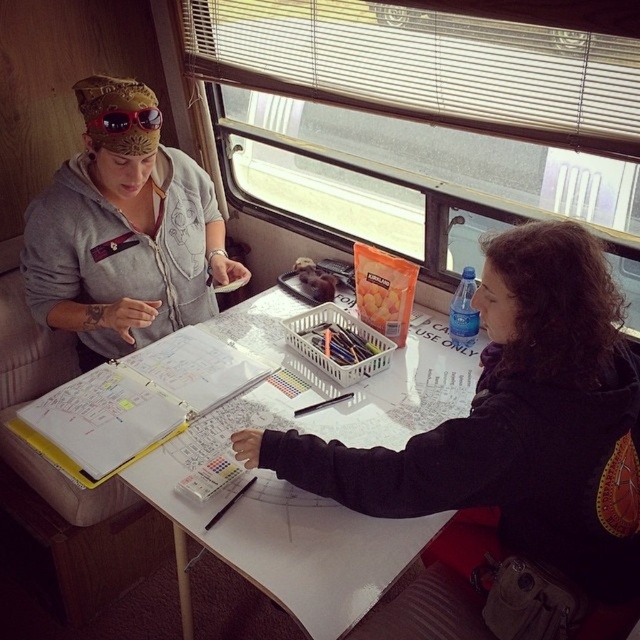
Question: Which point is closer to the camera?

Choices:
 (A) matte gray hoodie at upper left
 (B) matte plastic ruler at center
 (C) white paper at center

Answer: (C)

Question: Which of the following is the closest to the observer?

Choices:
 (A) (596, 589)
 (B) (243, 492)
 (C) (317, 406)
 (D) (352, 573)

Answer: (D)

Question: Can you confirm if black matte hoodie at center is positioned above red plastic sunglasses at upper left?

Choices:
 (A) yes
 (B) no

Answer: (B)

Question: Is matte gray hoodie at upper left above black plastic pen at center?

Choices:
 (A) yes
 (B) no

Answer: (A)

Question: Does matte gray hoodie at upper left appear over black plastic pen at center?

Choices:
 (A) no
 (B) yes

Answer: (B)

Question: Which is nearer to the black plastic pen at center?

Choices:
 (A) matte plastic ruler at center
 (B) black matte hoodie at center
 (C) red plastic sunglasses at upper left

Answer: (A)